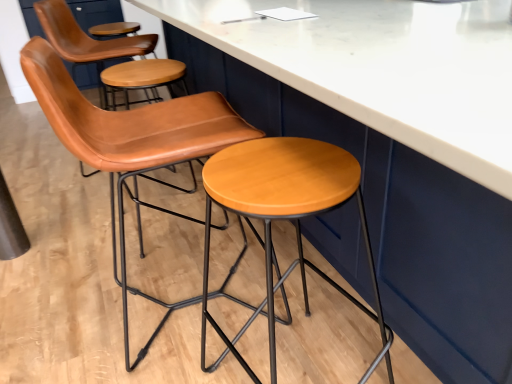
The image size is (512, 384). Describe the element at coordinates (284, 218) in the screenshot. I see `wooden/matte stool at center` at that location.

This screenshot has height=384, width=512. In order to click on wooden/matte stool at center in this screenshot , I will do `click(284, 218)`.

This screenshot has height=384, width=512. I want to click on leather at center, so click(132, 145).

Image resolution: width=512 pixels, height=384 pixels. Describe the element at coordinates (132, 145) in the screenshot. I see `leather at center` at that location.

Locate an element on the screen. The height and width of the screenshot is (384, 512). wooden/matte stool at center is located at coordinates (284, 218).

Between leather at center and wooden/matte stool at center, which one appears on the right side from the viewer's perspective?

Positioned to the right is wooden/matte stool at center.

Looking at this image, considering the positions of objects leather at center and wooden/matte stool at center in the image provided, who is behind, leather at center or wooden/matte stool at center?

leather at center is behind.

Considering the positions of point (170, 142) and point (245, 196), is point (170, 142) closer or farther from the camera than point (245, 196)?

Point (170, 142) appears to be farther away from the viewer than point (245, 196).

From the image's perspective, is leather at center on top of wooden/matte stool at center?

Yes.

From a real-world perspective, who is located higher, leather at center or wooden/matte stool at center?

leather at center, from a real-world perspective.

Considering the sizes of objects leather at center and wooden/matte stool at center in the image provided, who is wider, leather at center or wooden/matte stool at center?

leather at center is wider.

Is leather at center taller or shorter than wooden/matte stool at center?

In the image, leather at center appears to be taller than wooden/matte stool at center.

Is leather at center smaller than wooden/matte stool at center?

Actually, leather at center might be larger than wooden/matte stool at center.

In the scene shown: Would you say leather at center is outside wooden/matte stool at center?

leather at center is positioned outside wooden/matte stool at center.

Is there a large distance between leather at center and wooden/matte stool at center?

Actually, leather at center and wooden/matte stool at center are a little close together.

Does leather at center turn towards wooden/matte stool at center?

No, leather at center does not turn towards wooden/matte stool at center.

Image resolution: width=512 pixels, height=384 pixels. I want to click on stool beneath the leather at center (from a real-world perspective), so click(284, 218).

Which object is positioned more to the left, wooden/matte stool at center or leather at center?

leather at center.

Considering the positions of objects wooden/matte stool at center and leather at center in the image provided, who is behind, wooden/matte stool at center or leather at center?

leather at center is further away from the camera.

Is point (258, 217) positioned before point (70, 102)?

No.

From the image's perspective, is wooden/matte stool at center positioned above or below leather at center?

wooden/matte stool at center is situated lower than leather at center in the image.

From a real-world perspective, is wooden/matte stool at center above or below leather at center?

In terms of real-world spatial position, wooden/matte stool at center is below leather at center.

Can you confirm if wooden/matte stool at center is thinner than leather at center?

Yes, wooden/matte stool at center is thinner than leather at center.

Considering the sizes of objects wooden/matte stool at center and leather at center in the image provided, who is taller, wooden/matte stool at center or leather at center?

leather at center.

Can you confirm if wooden/matte stool at center is smaller than leather at center?

Indeed, wooden/matte stool at center has a smaller size compared to leather at center.

Do you think wooden/matte stool at center is within leather at center, or outside of it?

wooden/matte stool at center cannot be found inside leather at center.

Is wooden/matte stool at center far from leather at center?

Actually, wooden/matte stool at center and leather at center are a little close together.

Is wooden/matte stool at center turned away from leather at center?

wooden/matte stool at center does not have its back to leather at center.

Find the location of a particular element. chair lying above the wooden/matte stool at center (from the image's perspective) is located at coordinates (132, 145).

Find the location of a particular element. stool in front of the leather at center is located at coordinates (284, 218).

The image size is (512, 384). There is a wooden/matte stool at center. What are the coordinates of `chair above it (from a real-world perspective)` in the screenshot? It's located at (132, 145).